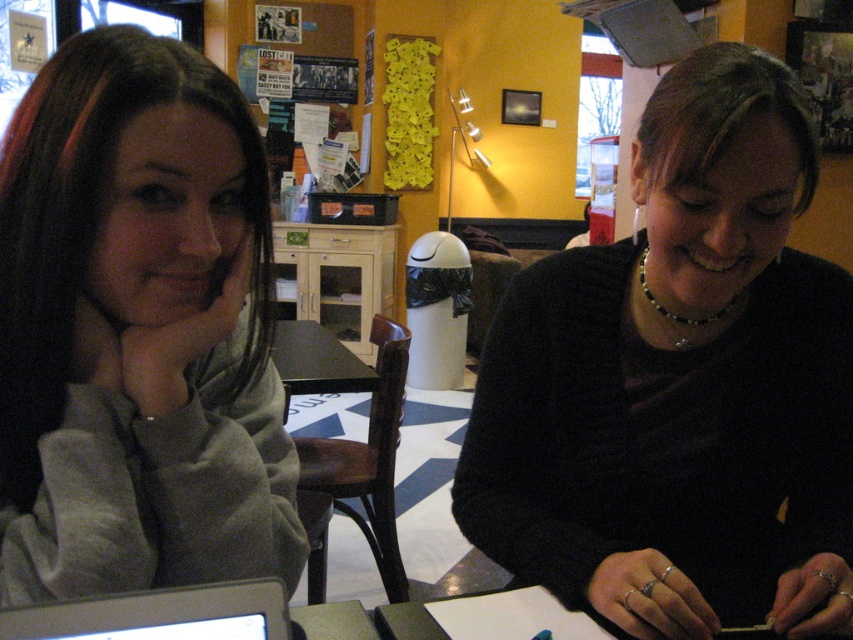
Does point (699, 486) come in front of point (97, 76)?

No, it is not.

Is black matte sweater at center thinner than gray fleece at left?

In fact, black matte sweater at center might be wider than gray fleece at left.

Is point (804, 200) positioned in front of point (45, 125)?

No, (804, 200) is behind (45, 125).

Locate an element on the screen. black matte sweater at center is located at coordinates (679, 384).

Who is positioned more to the left, black matte sweater at center or silver metallic laptop at lower left?

silver metallic laptop at lower left is more to the left.

Is point (676, 636) farther from camera compared to point (64, 618)?

Yes, it is.

Locate an element on the screen. This screenshot has width=853, height=640. black matte sweater at center is located at coordinates (679, 384).

The height and width of the screenshot is (640, 853). I want to click on black matte sweater at center, so click(679, 384).

Which is above, gray fleece at left or silver metallic laptop at lower left?

gray fleece at left is higher up.

Does gray fleece at left lie behind silver metallic laptop at lower left?

Yes, gray fleece at left is behind silver metallic laptop at lower left.

Where is `gray fleece at left`? The width and height of the screenshot is (853, 640). gray fleece at left is located at coordinates (135, 330).